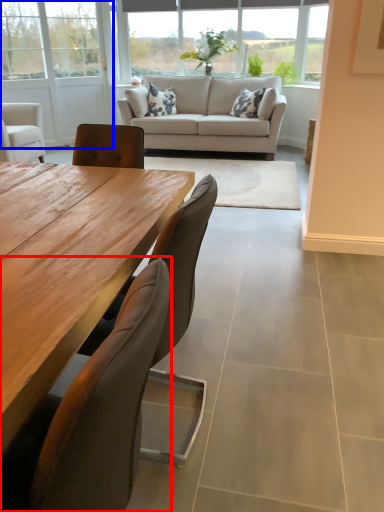
Question: Which point is closer to the camera, chair (highlighted by a red box) or screen door (highlighted by a blue box)?

Choices:
 (A) chair
 (B) screen door

Answer: (A)